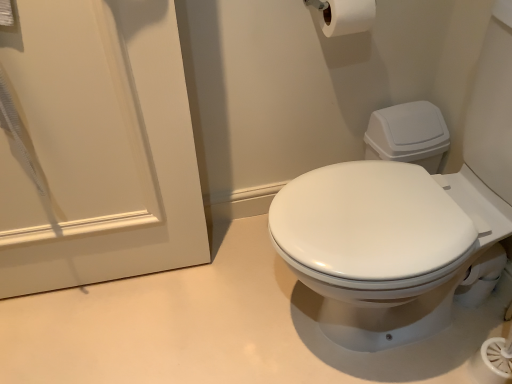
Question: From a real-world perspective, is white matte door at upper left physically below white matte toilet paper at upper center?

Choices:
 (A) yes
 (B) no

Answer: (A)

Question: Considering the relative positions of white matte door at upper left and white matte toilet paper at upper center in the image provided, is white matte door at upper left in front of white matte toilet paper at upper center?

Choices:
 (A) yes
 (B) no

Answer: (A)

Question: From the image's perspective, does white matte door at upper left appear lower than white matte toilet paper at upper center?

Choices:
 (A) no
 (B) yes

Answer: (B)

Question: Can you confirm if white matte door at upper left is positioned to the right of white matte toilet paper at upper center?

Choices:
 (A) no
 (B) yes

Answer: (A)

Question: From the image's perspective, is white matte door at upper left over white matte toilet paper at upper center?

Choices:
 (A) yes
 (B) no

Answer: (B)

Question: Is white matte door at upper left bigger than white matte toilet paper at upper center?

Choices:
 (A) yes
 (B) no

Answer: (A)

Question: Is white matte toilet paper at upper center next to white matte door at upper left and touching it?

Choices:
 (A) yes
 (B) no

Answer: (B)

Question: Can you confirm if white matte toilet paper at upper center is positioned to the right of white matte door at upper left?

Choices:
 (A) yes
 (B) no

Answer: (A)

Question: From a real-world perspective, is white matte toilet paper at upper center under white matte door at upper left?

Choices:
 (A) no
 (B) yes

Answer: (A)

Question: Is the depth of white matte toilet paper at upper center greater than that of white matte door at upper left?

Choices:
 (A) no
 (B) yes

Answer: (B)

Question: Does white matte toilet paper at upper center have a smaller size compared to white matte door at upper left?

Choices:
 (A) yes
 (B) no

Answer: (A)

Question: Considering the relative sizes of white matte toilet paper at upper center and white matte door at upper left in the image provided, is white matte toilet paper at upper center shorter than white matte door at upper left?

Choices:
 (A) no
 (B) yes

Answer: (B)

Question: Would you say white matte toilet paper at upper center is to the left or to the right of white matte door at upper left in the picture?

Choices:
 (A) left
 (B) right

Answer: (B)